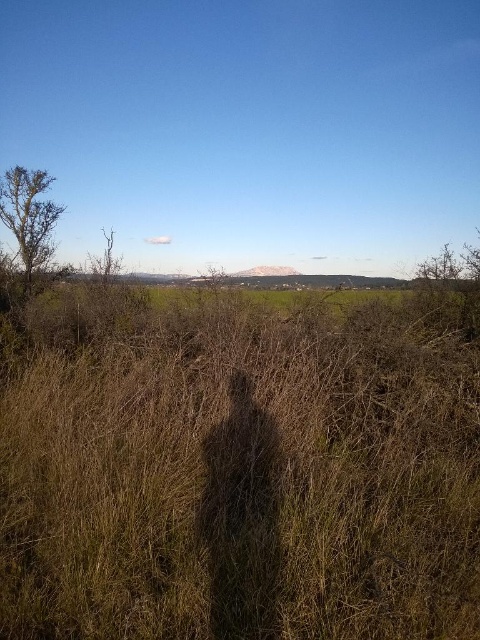
You are a gardener planning to mow the lawn. You notice the brown dry grass at center and the bare branches at left in the scene. Which object is shorter and requires trimming to match the desired lawn height?

The brown dry grass at center is shorter than the bare branches at left, so it does not require trimming. The bare branches at left are taller and may need pruning to maintain the lawn height.

Based on the photo, you are a gardener planning to mow the lawn. You notice the brown dry grass at center and the bare branches at left in the scene. Which area requires more attention based on their widths?

The brown dry grass at center requires more attention because its width is larger than the bare branches at left, indicating it might need mowing sooner.